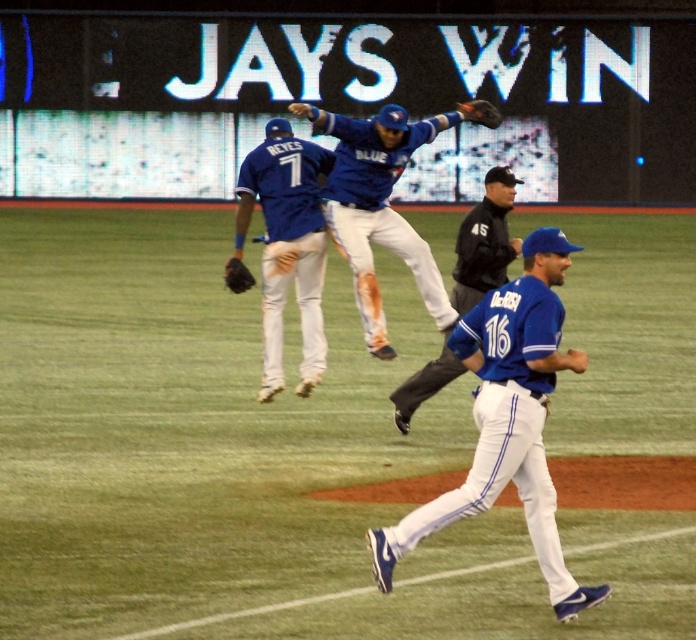
You are a photographer at the baseball field and want to capture a photo of the dark brown leather glove at upper center and the black leather glove at center. Which glove should you focus on first if you want to ensure both are in sharp focus?

You should focus on the dark brown leather glove at upper center first because the black leather glove at center is behind it, so adjusting focus starting from the front object ensures both are in sharp focus.

You are a photographer standing at the center of the baseball field. You want to take a photo of the blue jersey at center. Where should you aim your camera to capture it?

You should aim your camera at point 0.656 on the x axis and 0.730 on the y axis to capture the blue jersey at center.

You are a baseball equipment manager who needs to store the dark brown leather glove at upper center and the black leather glove at center. If the storage compartment can only fit one glove at a time, which glove should you place first to ensure it fits properly?

The dark brown leather glove at upper center might be wider than the black leather glove at center, so you should place the dark brown leather glove at upper center first to ensure it fits in the storage compartment.